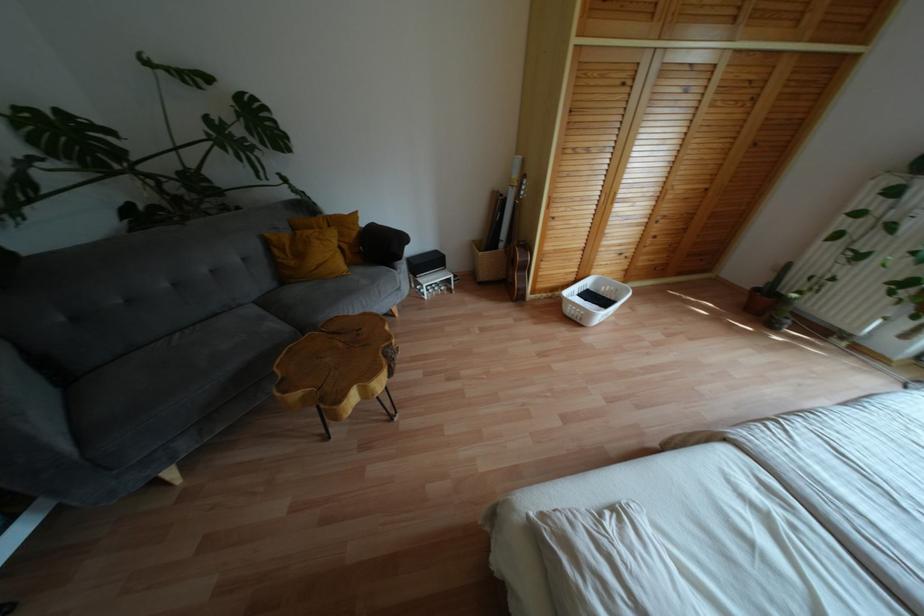
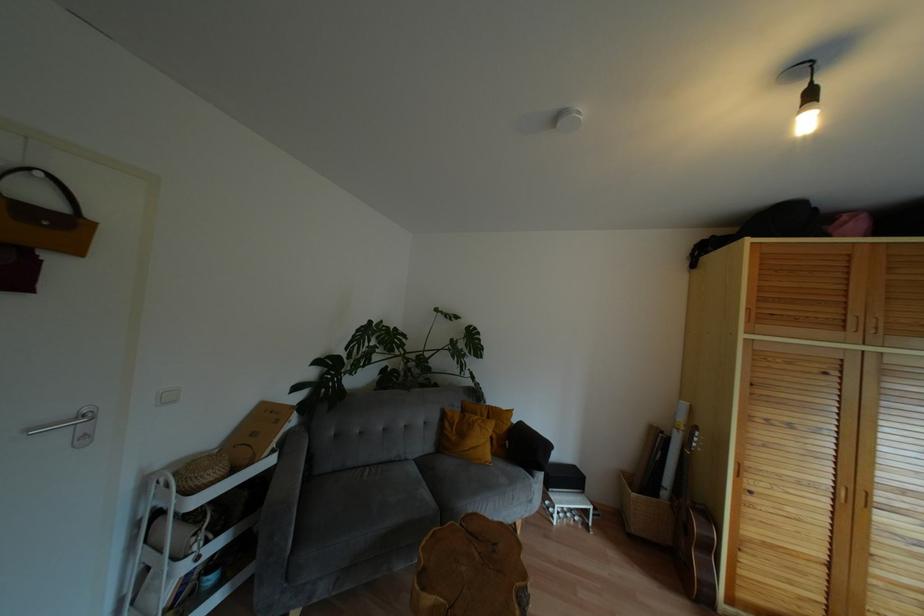
Question: I am providing you with two images of the same scene from different viewpoints. Please identify which objects are invisible in image2.

Choices:
 (A) yellow handbag
 (B) wooden cabinet handle
 (C) woven basket
 (D) none of these

Answer: (D)